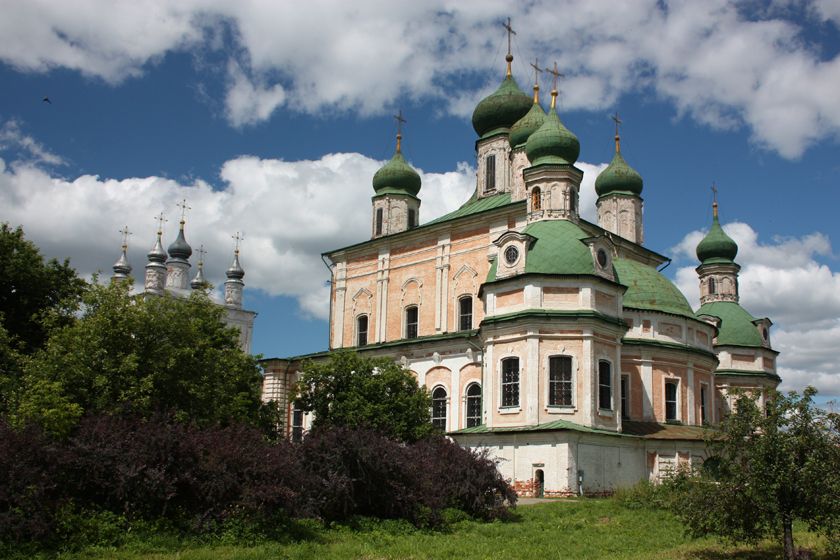
You are a GUI agent. You are given a task and a screenshot of the screen. Output one action in this format:
    pyautogui.click(x=<x>, y=<y>)
    Task: Click on the circular windows
    This screenshot has height=560, width=840.
    Given the screenshot: What is the action you would take?
    pyautogui.click(x=512, y=255), pyautogui.click(x=599, y=254)